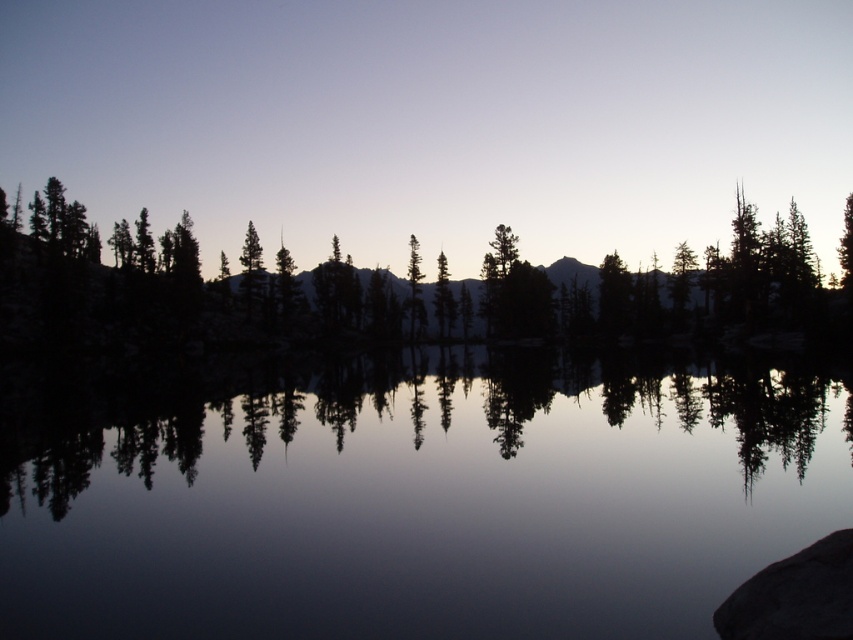
Question: Estimate the real-world distances between objects in this image. Which object is farther from the silhouette tree at left?

Choices:
 (A) transparent water at center
 (B) black rock at lower right

Answer: (B)

Question: Does silhouette tree at left appear on the left side of black rock at lower right?

Choices:
 (A) no
 (B) yes

Answer: (A)

Question: Which of the following is the closest to the observer?

Choices:
 (A) black rock at lower right
 (B) silhouette tree at left

Answer: (A)

Question: From the image, what is the correct spatial relationship of transparent water at center in relation to silhouette tree at left?

Choices:
 (A) right
 (B) left

Answer: (B)

Question: Can you confirm if transparent water at center is wider than silhouette tree at left?

Choices:
 (A) yes
 (B) no

Answer: (B)

Question: Which point appears farthest from the camera in this image?

Choices:
 (A) (796, 609)
 (B) (308, 477)
 (C) (248, 272)

Answer: (C)